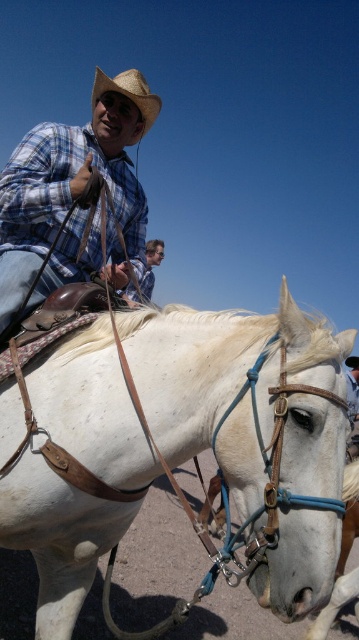
You are an observer standing in front of the image. You notice the plaid cotton shirt at upper left and the light brown leather belt at upper center. Which object is wider?

The plaid cotton shirt at upper left is wider than the light brown leather belt at upper center.

You are a photographer standing in front of the scene. You want to take a photo of both the white leather horse at center and the light brown leather belt at upper center without any obstruction. Given that your camera has a maximum focus range of 30 inches, will you be able to capture both subjects in focus?

The white leather horse at center and the light brown leather belt at upper center are 33.59 inches apart from each other. Since the distance between them exceeds the camera maximum focus range of 30 inches, you won the be able to capture both subjects in focus.